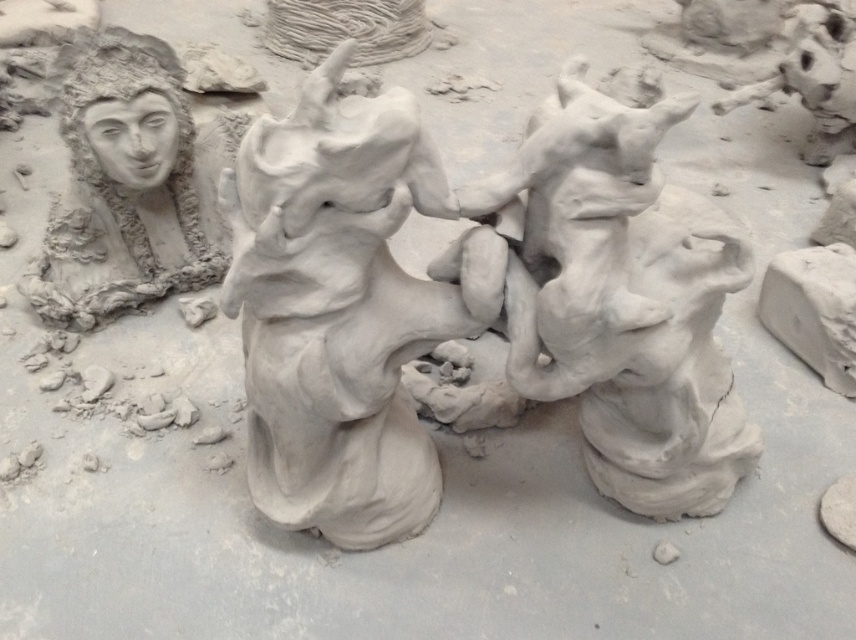
Where is the clay figure at center located in terms of coordinates?

The clay figure at center is located at point (342, 308).

You are an art student who wants to display these two sculptures in a showcase. The showcase has a height limit of 30 cm. The clay sculpture at center is 40 cm tall, and the matte clay face at upper left is 25 cm tall. Which sculpture will exceed the height limit?

The clay sculpture at center is bigger than matte clay face at upper left. Since the showcase has a height limit of 30 cm, the clay sculpture at center, being 40 cm tall, will exceed the height limit.

You are an art student who wants to place a new sculpture between the clay figure at center and the clay sculpture at center. Which one should you place it next to if you want it to be the same size as the smaller one?

You should place the new sculpture next to the clay figure at center because it is smaller than the clay sculpture at center.